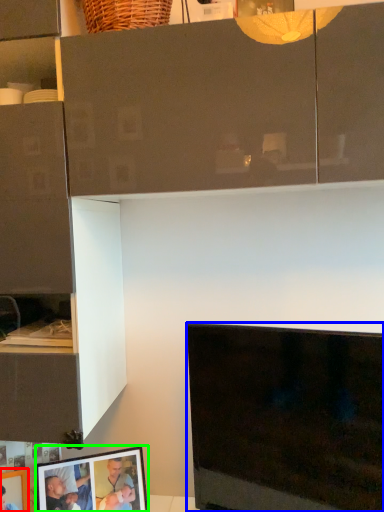
Question: Which object is the farthest from picture frame (highlighted by a red box)? Choose among these: television (highlighted by a blue box) or picture frame (highlighted by a green box).

Choices:
 (A) television
 (B) picture frame

Answer: (A)